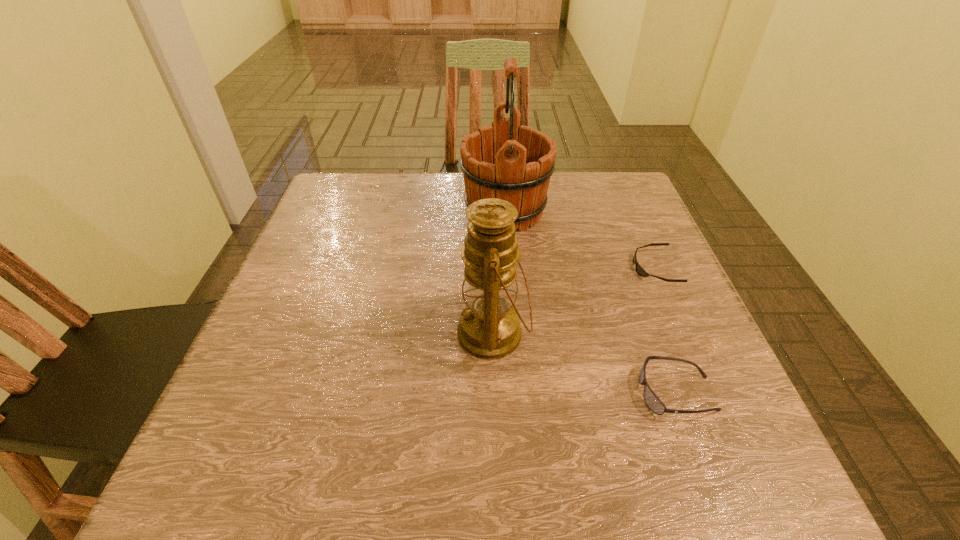
This screenshot has height=540, width=960. Identify the location of the farthest object. [506, 161].

Locate an element on the screen. The width and height of the screenshot is (960, 540). wine bucket is located at coordinates (506, 161).

Where is `the second tallest object`? This screenshot has width=960, height=540. the second tallest object is located at coordinates (489, 328).

The width and height of the screenshot is (960, 540). Find the location of `the second shortest object`. the second shortest object is located at coordinates (654, 404).

The image size is (960, 540). I want to click on the nearer sunglasses, so click(654, 404).

The height and width of the screenshot is (540, 960). Identify the location of the second farthest object. (640, 271).

You are a GUI agent. You are given a task and a screenshot of the screen. Output one action in this format:
    pyautogui.click(x=<x>, y=<y>)
    Task: Click on the shorter sunglasses
    
    Given the screenshot: What is the action you would take?
    pyautogui.click(x=640, y=271)

The height and width of the screenshot is (540, 960). I want to click on free location located on the left of the tallest object, so point(370,212).

The height and width of the screenshot is (540, 960). Identify the location of vacant space located on the left of the oil lamp. (365, 334).

Locate an element on the screen. vacant space located 0.380m on the lenses of the second shortest object is located at coordinates (408, 393).